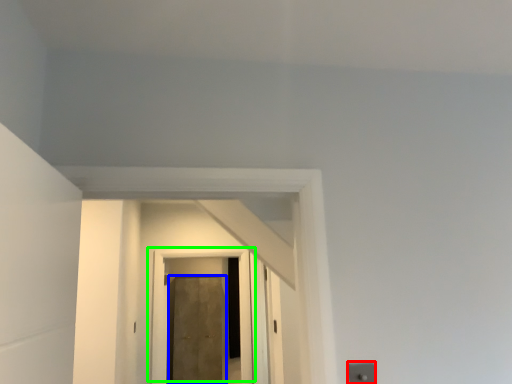
Question: Considering the real-world distances, which object is farthest from electric outlet (highlighted by a red box)? door (highlighted by a blue box) or door (highlighted by a green box)?

Choices:
 (A) door
 (B) door

Answer: (A)